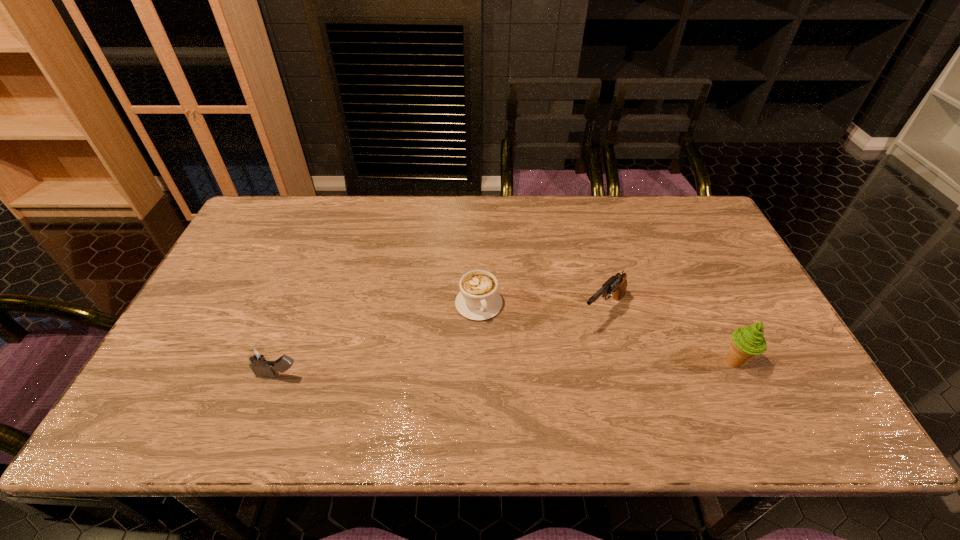
Where is `vacant region located 0.260m along the barrel of the third object from left to right`? vacant region located 0.260m along the barrel of the third object from left to right is located at coordinates (521, 389).

Where is `vacant area situated to the right of the cappuccino's handle`? The image size is (960, 540). vacant area situated to the right of the cappuccino's handle is located at coordinates (492, 340).

Identify the location of vacant space located 0.220m to the right of the cappuccino's handle. (514, 395).

In order to click on vacant space located 0.090m to the right of the cappuccino's handle in this screenshot , I will do pos(496,350).

I want to click on igniter that is at the near edge, so click(x=259, y=362).

Image resolution: width=960 pixels, height=540 pixels. Identify the location of icecream at the near edge. (x=746, y=342).

Where is `object that is at the right edge`? The height and width of the screenshot is (540, 960). object that is at the right edge is located at coordinates (746, 342).

The width and height of the screenshot is (960, 540). I want to click on object that is at the near right corner, so click(x=746, y=342).

At what (x,y) coordinates should I click in order to perform the action: click on free spot at the far edge of the desktop. Please return your answer as a coordinate pair (x, y). This screenshot has height=540, width=960. Looking at the image, I should click on (482, 197).

This screenshot has width=960, height=540. I want to click on vacant space at the left edge of the desktop, so click(221, 303).